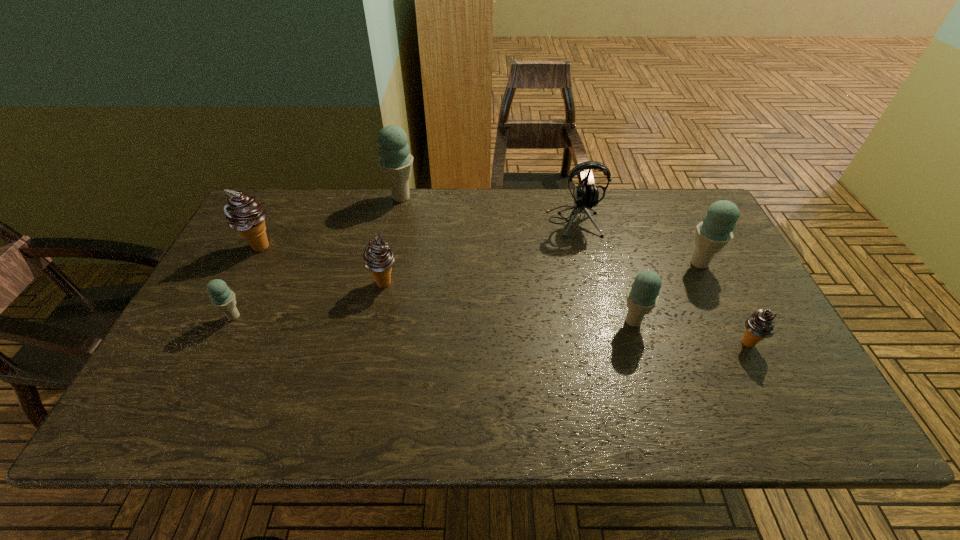
The image size is (960, 540). Find the location of `free space located 0.380m on the left of the rightmost chocolate icecream`. free space located 0.380m on the left of the rightmost chocolate icecream is located at coordinates point(577,343).

At what (x,y) coordinates should I click in order to perform the action: click on vacant space located 0.260m on the front of the leftmost blue ice cream. Please return your answer as a coordinate pair (x, y). The image size is (960, 540). Looking at the image, I should click on (180, 424).

This screenshot has width=960, height=540. I want to click on earphone that is positioned at the far edge, so click(585, 196).

This screenshot has width=960, height=540. I want to click on object present at the far left corner, so click(x=243, y=213).

You are a GUI agent. You are given a task and a screenshot of the screen. Output one action in this format:
    pyautogui.click(x=<x>, y=<y>)
    Task: Click on the free space at the far edge of the desktop
    The height and width of the screenshot is (540, 960).
    Given the screenshot: What is the action you would take?
    pyautogui.click(x=597, y=225)

Identify the location of vacant space at the near edge of the desktop. 402,421.

This screenshot has height=540, width=960. Identify the location of free space at the left edge. (165, 369).

I want to click on vacant space at the right edge of the desktop, so click(705, 310).

Identify the location of vacant space at the far left corner. (296, 222).

Where is `free space that is in between the farthest chocolate icecream and the farthest ice cream`? The height and width of the screenshot is (540, 960). free space that is in between the farthest chocolate icecream and the farthest ice cream is located at coordinates (331, 222).